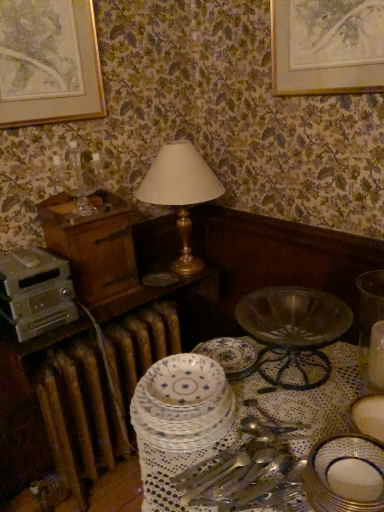
I want to click on free space above porcelain plate at center, which appears as the 3th plate when viewed from the right (from a real-world perspective), so click(x=183, y=390).